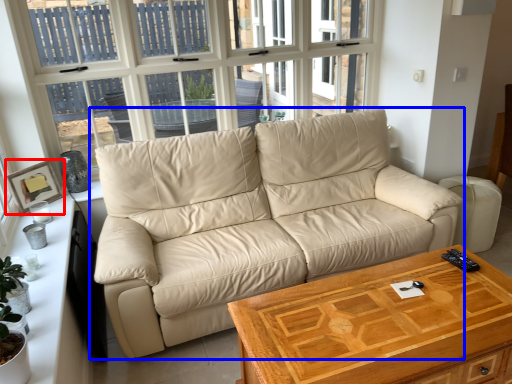
Question: Which object is further to the camera taking this photo, picture frame (highlighted by a red box) or studio couch (highlighted by a blue box)?

Choices:
 (A) picture frame
 (B) studio couch

Answer: (A)